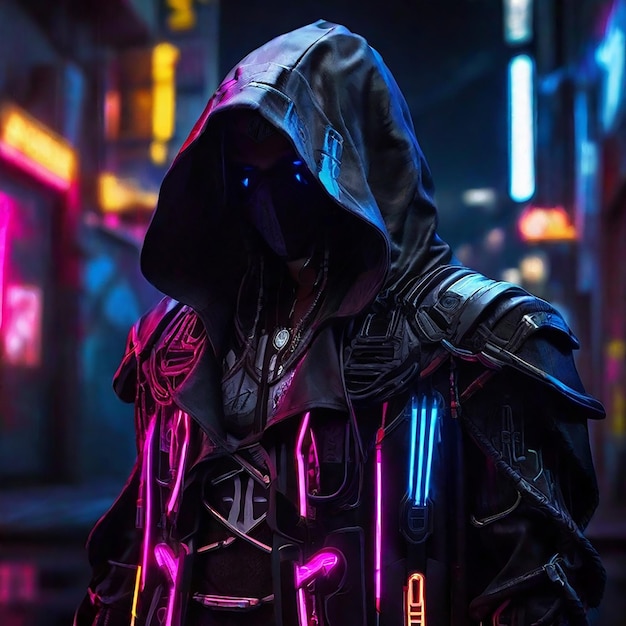
Find the location of a particular element. This screenshot has height=626, width=626. hood is located at coordinates (351, 115).